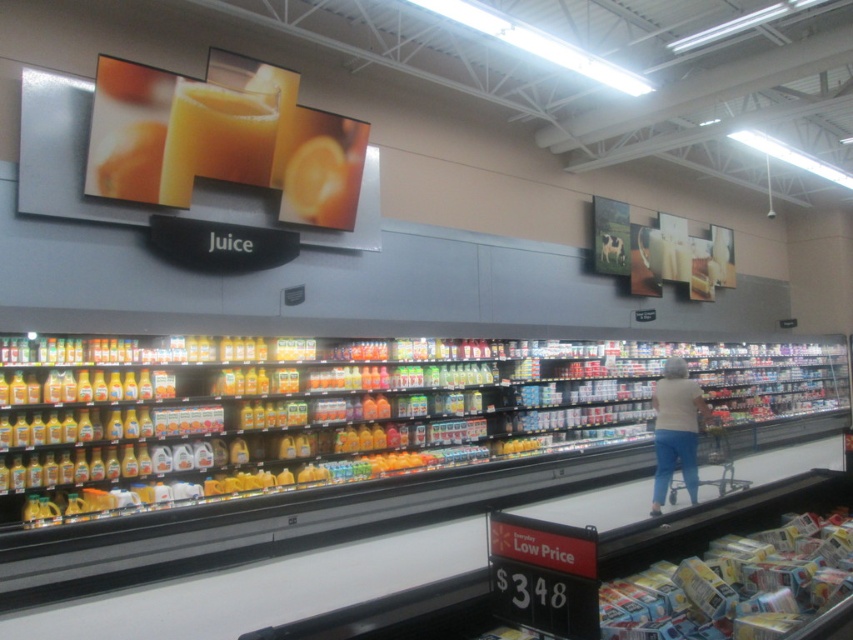
Question: Is smooth orange juice at upper center below white cotton shirt at center?

Choices:
 (A) no
 (B) yes

Answer: (A)

Question: Can you confirm if smooth orange juice at upper center is wider than white cotton shirt at center?

Choices:
 (A) no
 (B) yes

Answer: (B)

Question: Among these objects, which one is nearest to the camera?

Choices:
 (A) white cotton shirt at center
 (B) smooth orange juice at upper center

Answer: (B)

Question: Can you confirm if smooth orange juice at upper center is thinner than white cotton shirt at center?

Choices:
 (A) yes
 (B) no

Answer: (B)

Question: Among these points, which one is farthest from the camera?

Choices:
 (A) (198, 160)
 (B) (685, 369)

Answer: (B)